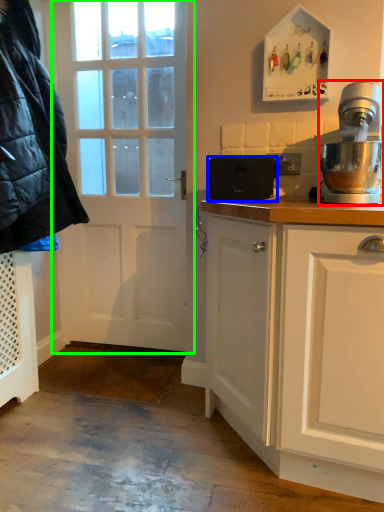
Question: Which is farther away from home appliance (highlighted by a red box)? appliance (highlighted by a blue box) or door (highlighted by a green box)?

Choices:
 (A) appliance
 (B) door

Answer: (B)